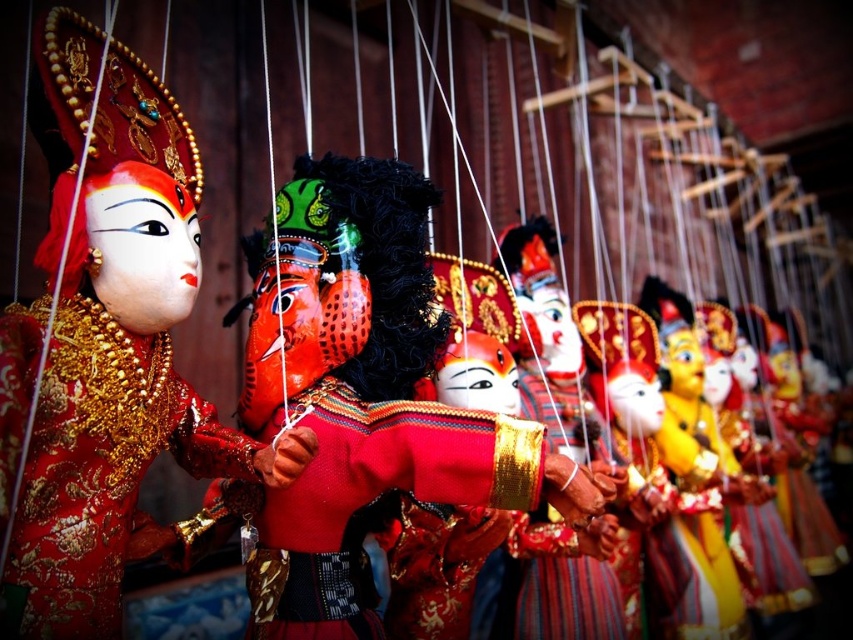
The image size is (853, 640). What do you see at coordinates (361, 397) in the screenshot? I see `matte red puppet at center` at bounding box center [361, 397].

Does matte red puppet at center appear on the left side of velvet red costume at center?

Correct, you'll find matte red puppet at center to the left of velvet red costume at center.

Where is `matte red puppet at center`? The width and height of the screenshot is (853, 640). matte red puppet at center is located at coordinates (361, 397).

At what (x,y) coordinates should I click in order to perform the action: click on gold embroidered dress at center. Please return your answer as a coordinate pair (x, y). The width and height of the screenshot is (853, 640). Looking at the image, I should click on (100, 468).

Measure the distance between gold embroidered dress at center and camera.

gold embroidered dress at center is 26.06 inches from camera.

At what (x,y) coordinates should I click in order to perform the action: click on gold embroidered dress at center. Please return your answer as a coordinate pair (x, y). This screenshot has width=853, height=640. Looking at the image, I should click on [100, 468].

Is matte gold mask at left to the right of gold embroidered dress at center from the viewer's perspective?

Correct, you'll find matte gold mask at left to the right of gold embroidered dress at center.

Between point (71, 28) and point (213, 465), which one is positioned in front?

Positioned in front is point (71, 28).

Find the location of a particular element. matte gold mask at left is located at coordinates (105, 339).

Where is `matte gold mask at left`? The image size is (853, 640). matte gold mask at left is located at coordinates (105, 339).